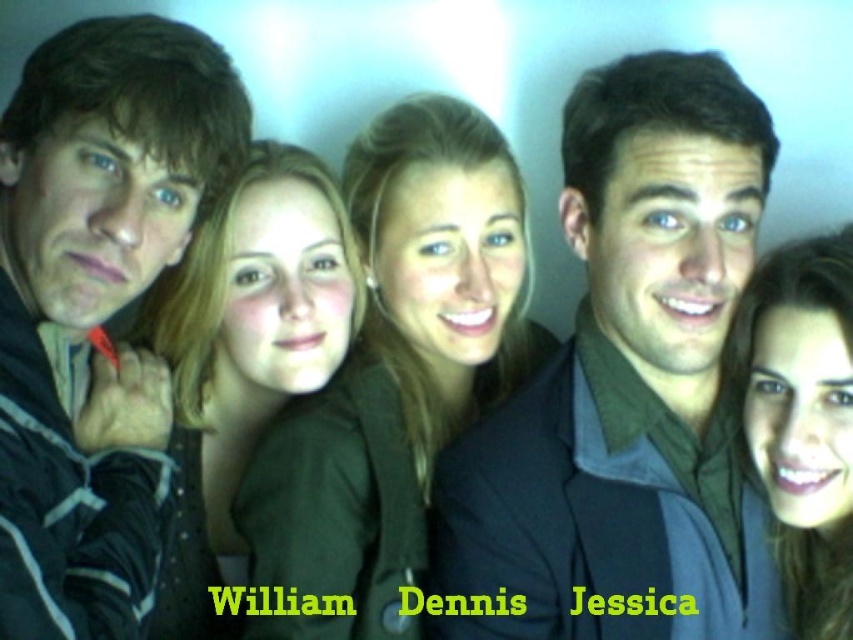
Can you confirm if smooth black shirt at center is positioned to the left of matte green shirt at left?

No, smooth black shirt at center is not to the left of matte green shirt at left.

Is point (605, 323) behind point (183, 632)?

No, (605, 323) is in front of (183, 632).

Who is more forward, (589, 192) or (270, 298)?

Positioned in front is point (589, 192).

Where is `smooth black shirt at center`? smooth black shirt at center is located at coordinates (627, 380).

Does smooth black shirt at center appear under dark gray jacket at left?

Correct, smooth black shirt at center is located below dark gray jacket at left.

Is smooth black shirt at center behind dark gray jacket at left?

Yes, smooth black shirt at center is behind dark gray jacket at left.

At what (x,y) coordinates should I click in order to perform the action: click on smooth black shirt at center. Please return your answer as a coordinate pair (x, y). Looking at the image, I should click on (627, 380).

This screenshot has width=853, height=640. Identify the location of smooth black shirt at center. (627, 380).

Is smooth black jacket at center below matte black hair at center?

No.

From the picture: Who is higher up, smooth black jacket at center or matte black hair at center?

smooth black jacket at center is higher up.

Where is `smooth black jacket at center`? The image size is (853, 640). smooth black jacket at center is located at coordinates (396, 371).

This screenshot has width=853, height=640. I want to click on smooth black jacket at center, so click(x=396, y=371).